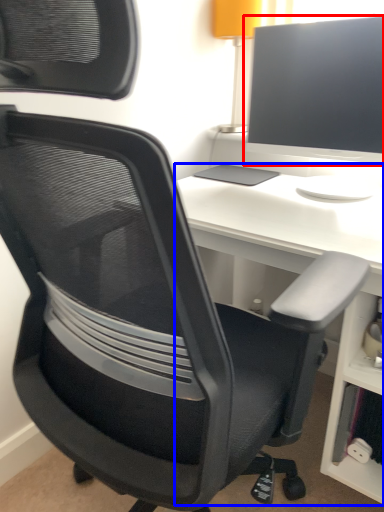
Question: Among these objects, which one is farthest to the camera, computer monitor (highlighted by a red box) or desk (highlighted by a blue box)?

Choices:
 (A) computer monitor
 (B) desk

Answer: (A)